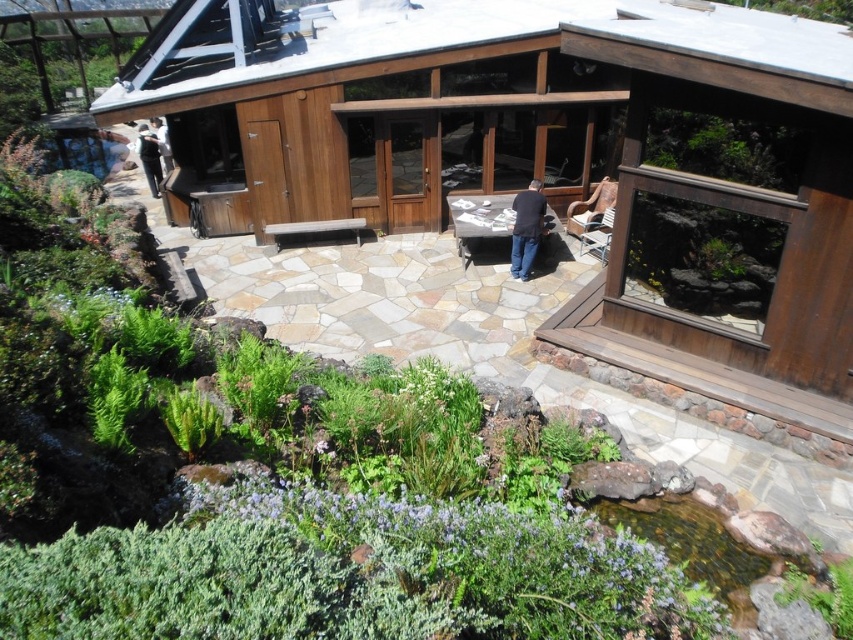
Question: Which point is farther from the camera taking this photo?

Choices:
 (A) [146, 134]
 (B) [524, 212]
 (C) [163, 160]

Answer: (A)

Question: Does dark blue jeans at center appear on the left side of dark blue jeans at left?

Choices:
 (A) no
 (B) yes

Answer: (A)

Question: Which point appears closest to the camera in this image?

Choices:
 (A) (541, 214)
 (B) (125, 140)
 (C) (149, 156)

Answer: (A)

Question: Based on their relative distances, which object is farther from the white fabric at left?

Choices:
 (A) dark blue jeans at center
 (B) green mossy rock at lower left

Answer: (A)

Question: In this image, where is green leafy plants at lower left located relative to green mossy rock at lower left?

Choices:
 (A) below
 (B) above

Answer: (A)

Question: Does green mossy rock at lower left appear over dark blue jeans at left?

Choices:
 (A) yes
 (B) no

Answer: (A)